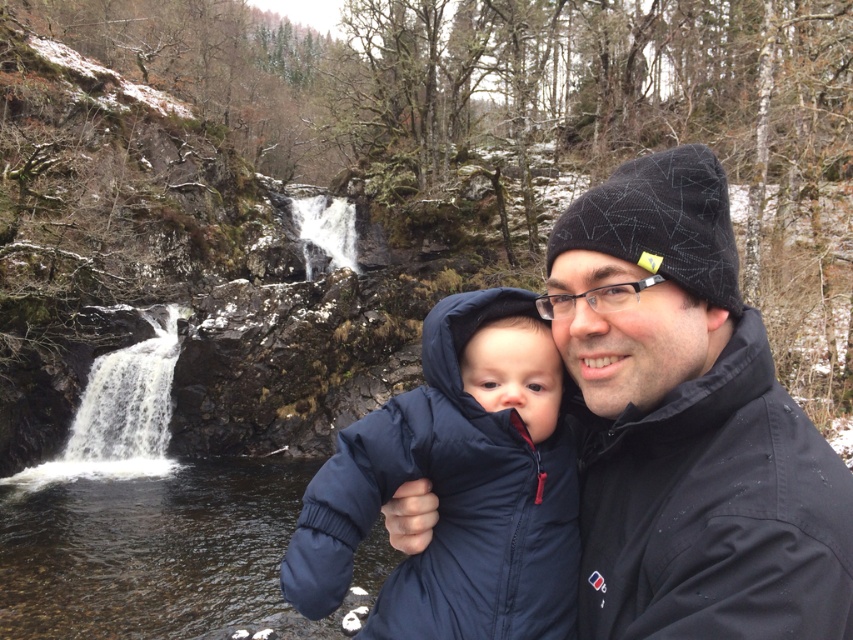
Question: Which point is farther to the camera?

Choices:
 (A) (833, 612)
 (B) (531, 385)
 (C) (527, 525)

Answer: (B)

Question: Among these objects, which one is farthest from the camera?

Choices:
 (A) navy blue puffer jacket at center
 (B) navy puffy jacket at center

Answer: (A)

Question: Does black matte jacket at right lie in front of navy puffy jacket at center?

Choices:
 (A) no
 (B) yes

Answer: (B)

Question: Which point appears farthest from the camera in this image?

Choices:
 (A) (734, 392)
 (B) (555, 358)

Answer: (B)

Question: Observing the image, what is the correct spatial positioning of navy puffy jacket at center in reference to navy blue puffer jacket at center?

Choices:
 (A) below
 (B) above

Answer: (A)

Question: In this image, where is navy puffy jacket at center located relative to navy blue puffer jacket at center?

Choices:
 (A) left
 (B) right

Answer: (A)